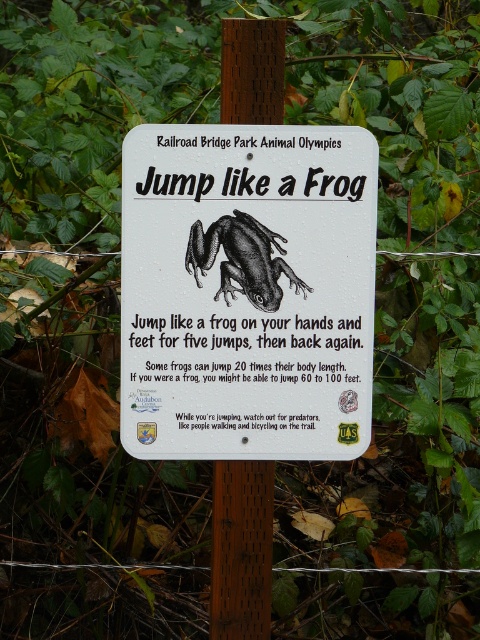
You are standing at the point labeled as point (241, 548) in the image. What object are you standing on?

You are standing on the brown wood post at center, as the point (241, 548) indicates the location of the brown wood post at center.

You are standing in front of the Railroad Bridge Park Animal Olympics signboard. You notice the white plastic sign at center and the brown wood post at center. Which object is closer to you?

The white plastic sign at center is closer to the viewer than the brown wood post at center.